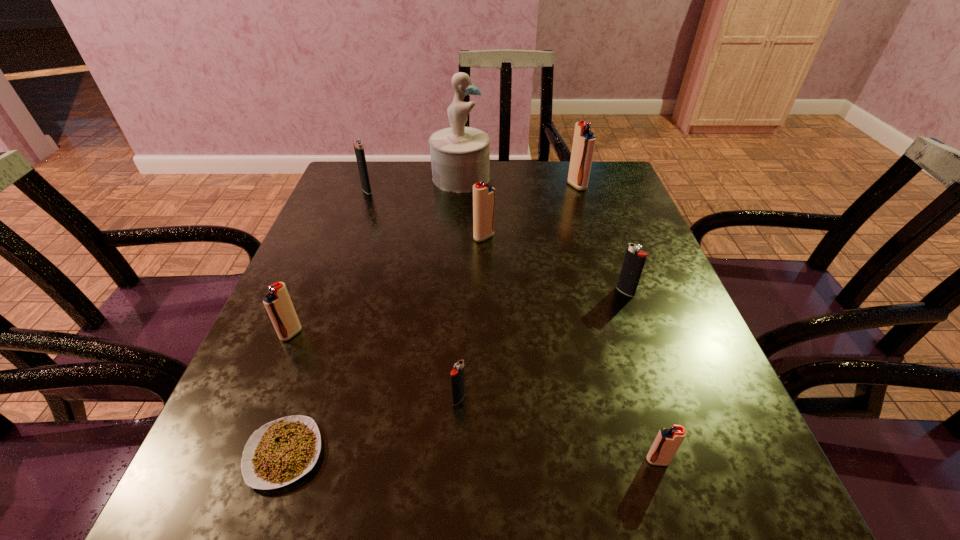
Where is `object that is at the near left corner`? Image resolution: width=960 pixels, height=540 pixels. object that is at the near left corner is located at coordinates (280, 452).

You are a GUI agent. You are given a task and a screenshot of the screen. Output one action in this format:
    pyautogui.click(x=<x>, y=<y>)
    Task: Click on the object located at the far right corner
    The width and height of the screenshot is (960, 540).
    Given the screenshot: What is the action you would take?
    pyautogui.click(x=584, y=140)

Locate an element on the screen. free space at the left edge of the desktop is located at coordinates (341, 258).

This screenshot has height=540, width=960. I want to click on free space at the right edge, so pos(658,338).

Find the location of `vacant space at the far left corner of the desktop`. vacant space at the far left corner of the desktop is located at coordinates (370, 204).

The height and width of the screenshot is (540, 960). I want to click on free space between the second black igniter from left to right and the tallest object, so click(x=460, y=288).

At what (x,y) coordinates should I click in order to perform the action: click on vacant space that is in between the fourth igniter from left to right and the figurine. Please return your answer as a coordinate pair (x, y). Looking at the image, I should click on (472, 207).

Identify the location of unoccupied area between the tallest object and the smallest red igniter. pyautogui.click(x=559, y=319).

The width and height of the screenshot is (960, 540). What are the coordinates of `free space between the farthest black igniter and the figurine` in the screenshot? It's located at (414, 184).

Where is `vacant region between the third farthest red igniter and the second igniter from left to right`? The height and width of the screenshot is (540, 960). vacant region between the third farthest red igniter and the second igniter from left to right is located at coordinates (329, 262).